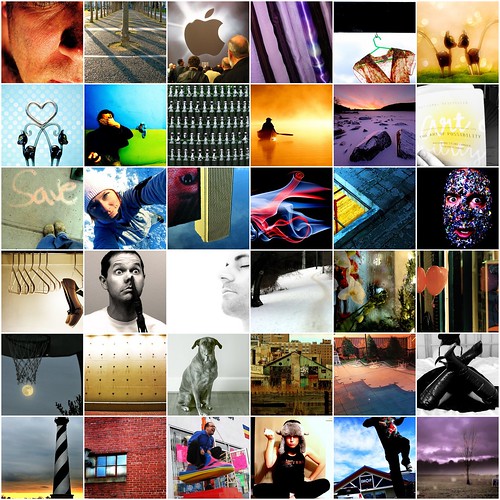
At what (x,y) coordinates should I click in order to perform the action: click on pictures in 4th row from top. Please return your answer as a coordinate pair (x, y). Looking at the image, I should click on (30, 292), (120, 292), (199, 294), (298, 296), (367, 294), (453, 290).